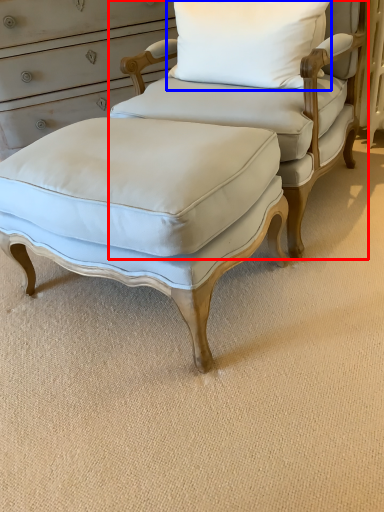
Question: Which of the following is the closest to the observer, chair (highlighted by a red box) or pillow (highlighted by a blue box)?

Choices:
 (A) chair
 (B) pillow

Answer: (A)